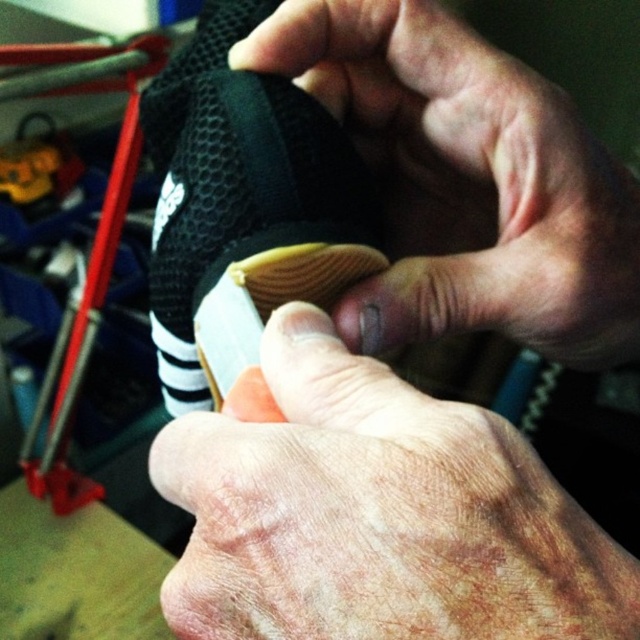
Is dry skin at center bigger than black matte shoe at center?

Yes.

In the scene shown: Who is positioned more to the right, dry skin at center or black matte shoe at center?

From the viewer's perspective, dry skin at center appears more on the right side.

Is point (189, 582) closer to viewer compared to point (593, 344)?

Yes, point (189, 582) is closer to viewer.

Locate an element on the screen. The height and width of the screenshot is (640, 640). dry skin at center is located at coordinates (376, 513).